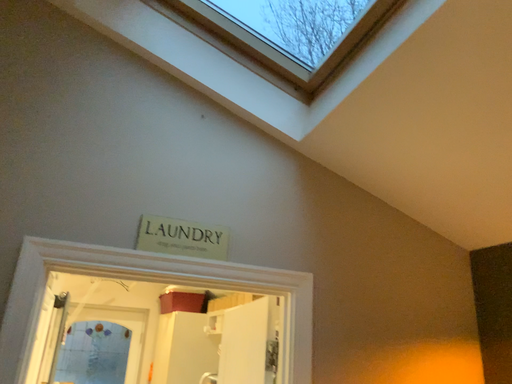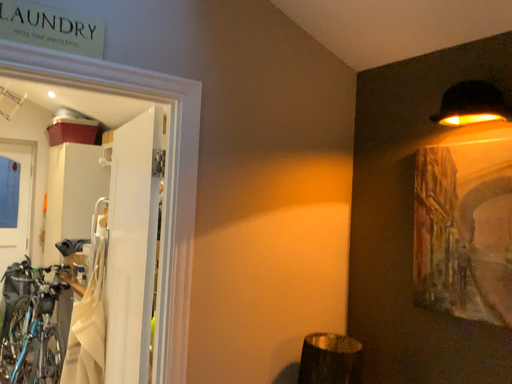
Question: How did the camera likely rotate when shooting the video?

Choices:
 (A) rotated left
 (B) rotated right

Answer: (B)